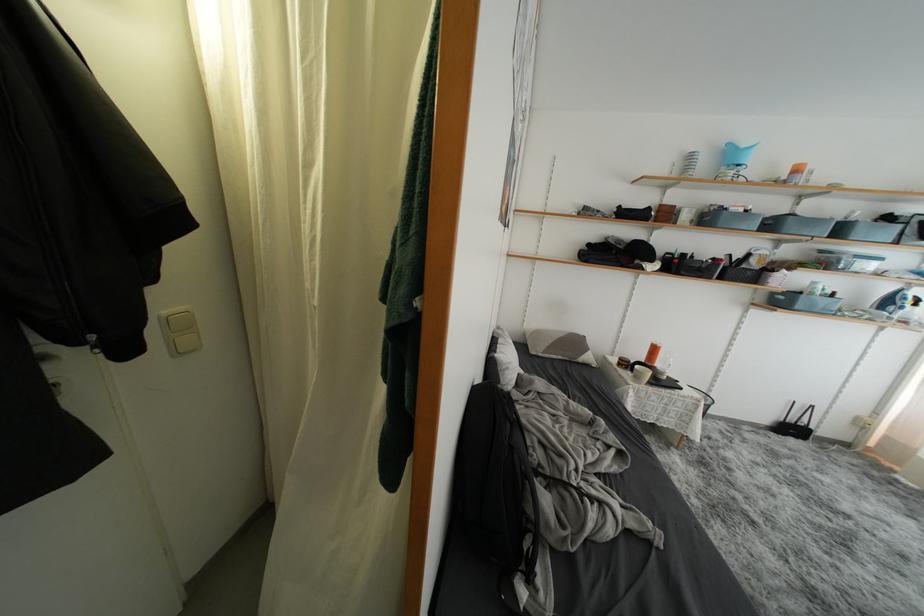
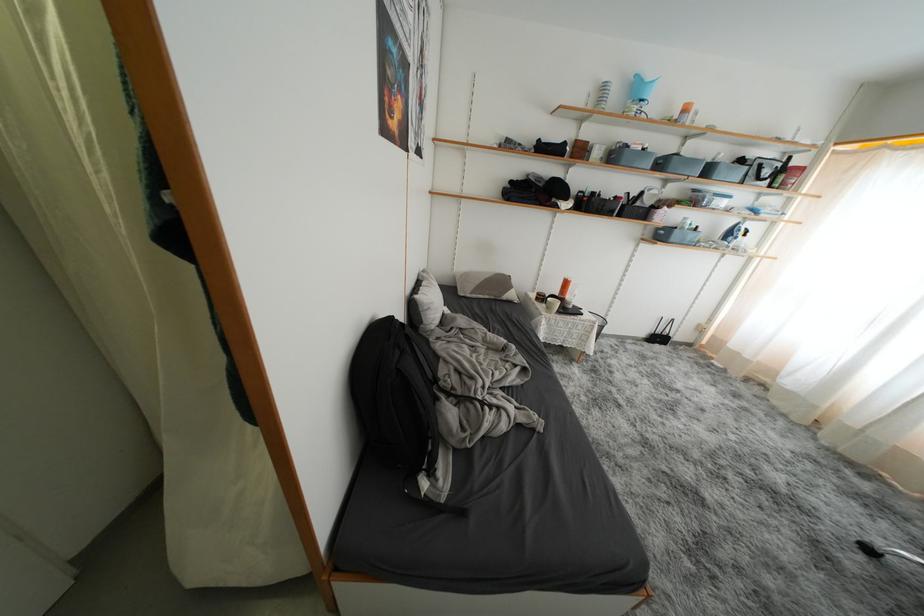
Find the pixel in the second image that matches the point at 661,354 in the first image.

(572, 286)